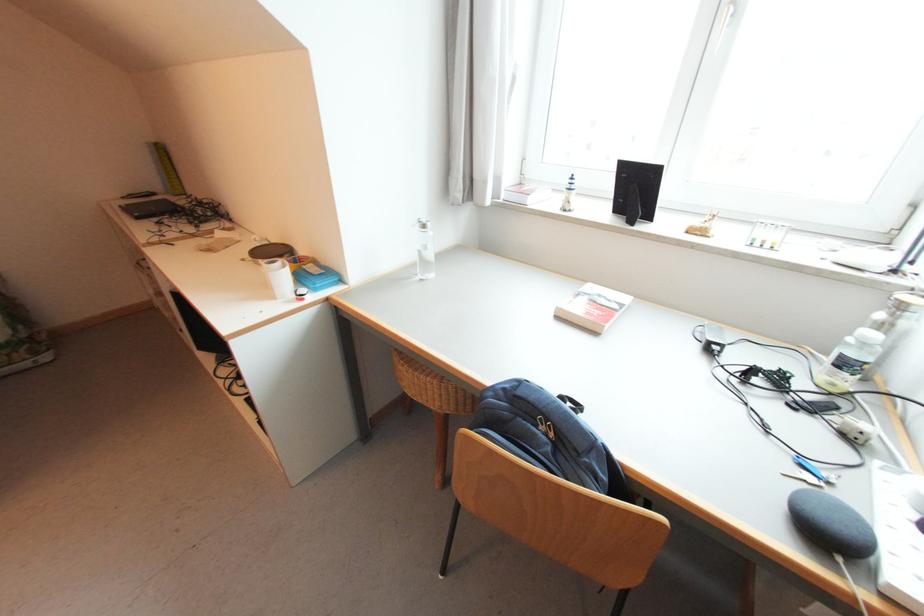
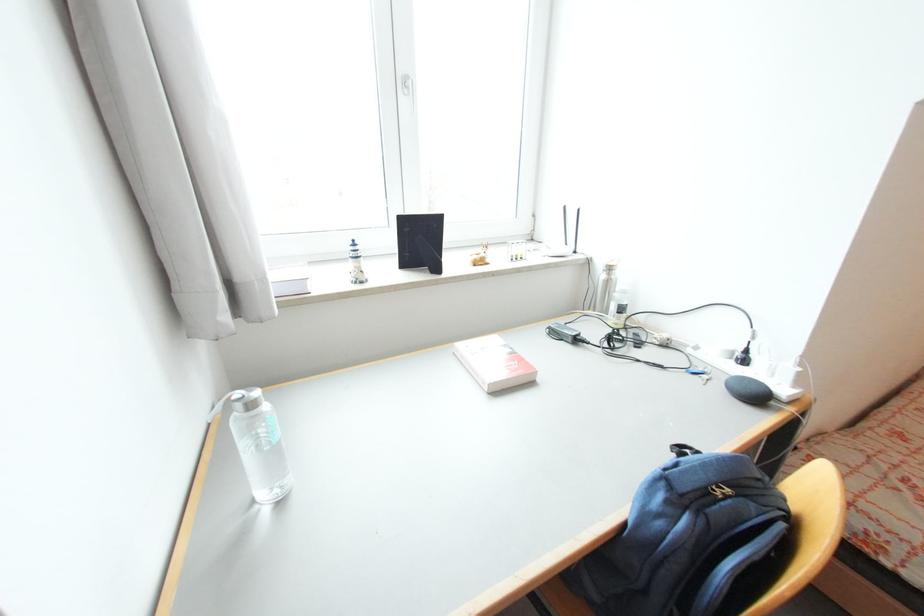
Locate, in the second image, the point that corresponds to the point at 816,464 in the first image.

(697, 370)